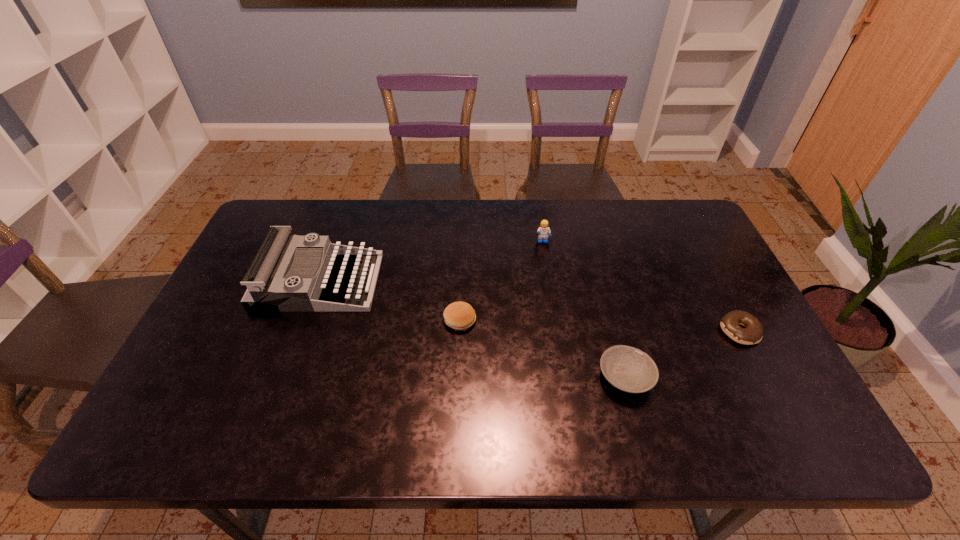
What are the coordinates of `free location that satisfies the following two spatial constraints: 1. on the front side of the rightmost object; 2. on the right side of the patty` in the screenshot? It's located at (460, 331).